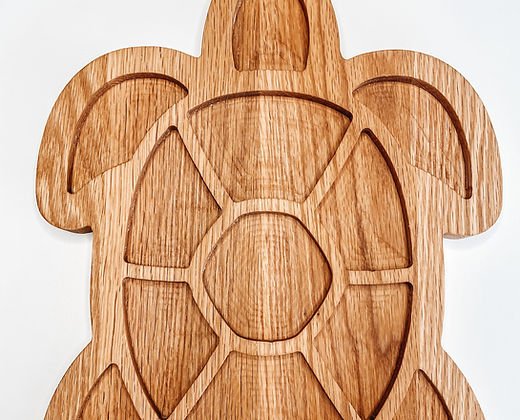
This screenshot has width=520, height=420. I want to click on side edge of tray, so click(86, 230), click(452, 237).